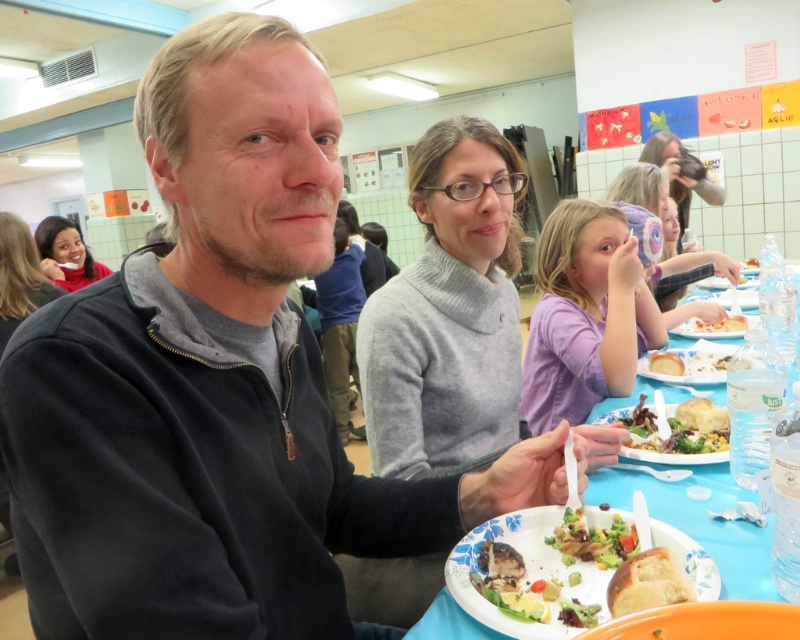
Question: Which point is closer to the camera?

Choices:
 (A) (692, 160)
 (B) (644, 573)

Answer: (B)

Question: Which object appears closest to the camera in this image?

Choices:
 (A) purple fabric mask at upper right
 (B) white paper plate at center

Answer: (B)

Question: Which of the following is the closest to the observer?

Choices:
 (A) vibrant mixed salad at center
 (B) brown matte bread at lower center

Answer: (B)

Question: Is purple fabric mask at upper right above matte black camera at upper right?

Choices:
 (A) no
 (B) yes

Answer: (A)

Question: From the image, what is the correct spatial relationship of matte red sweater at upper left in relation to white matte bread at center?

Choices:
 (A) below
 (B) above

Answer: (B)

Question: Is purple fabric mask at upper right below smooth white cake at right?

Choices:
 (A) no
 (B) yes

Answer: (A)